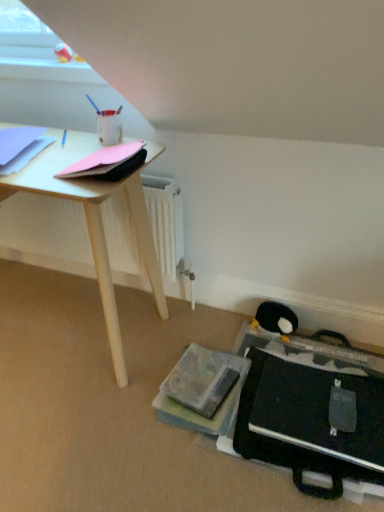
Identify the location of vacant area to the right of black plush penguin at lower right. This screenshot has height=512, width=384. (327, 342).